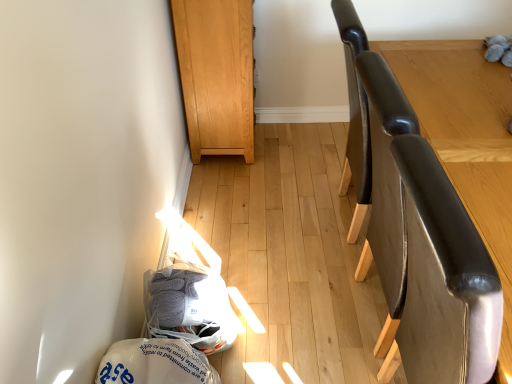
Image resolution: width=512 pixels, height=384 pixels. I want to click on vacant area that is in front of light brown wood cabinet at upper center, so click(x=240, y=190).